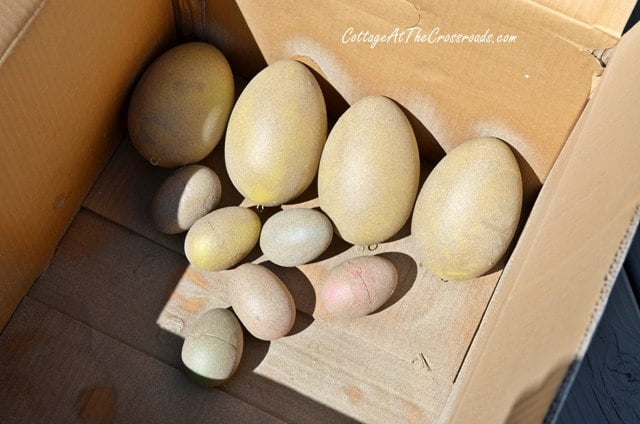
What are the coordinates of `cardboard box` in the screenshot? It's located at (22, 94).